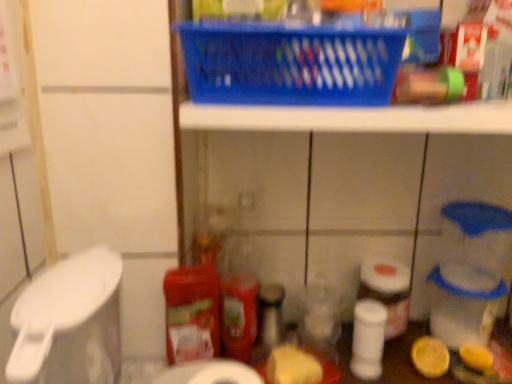
Where is `white matte toilet paper at lower right, which is the 3th toilet paper from left to right`? The image size is (512, 384). white matte toilet paper at lower right, which is the 3th toilet paper from left to right is located at coordinates (476, 356).

What is the approximate width of white matte toilet paper at lower center, arranged as the third toilet paper when viewed from the back?

white matte toilet paper at lower center, arranged as the third toilet paper when viewed from the back, is 4.71 inches wide.

This screenshot has height=384, width=512. What do you see at coordinates (368, 339) in the screenshot? I see `white matte toilet paper at center, acting as the second toilet paper starting from the right` at bounding box center [368, 339].

In order to face yellow matte lemon at lower right, should I rotate leftwards or rightwards?

Rotate right and turn 22.379 degrees.

What is the approximate width of matte red plastic bottle at center?

It is 1.43 inches.

Where is `white matte toilet paper at lower right, the third toilet paper viewed from the front`? This screenshot has height=384, width=512. white matte toilet paper at lower right, the third toilet paper viewed from the front is located at coordinates (476, 356).

Can you confirm if white matte toilet paper at lower right, the third toilet paper viewed from the front, is taller than yellow matte cheese at center?

Yes, white matte toilet paper at lower right, the third toilet paper viewed from the front, is taller than yellow matte cheese at center.

From a real-world perspective, is white matte toilet paper at lower right, the first toilet paper from the right, positioned under yellow matte cheese at center based on gravity?

Yes, from a real-world perspective, white matte toilet paper at lower right, the first toilet paper from the right, is beneath yellow matte cheese at center.

Considering the sizes of objects white matte toilet paper at lower right, the third toilet paper viewed from the front, and yellow matte cheese at center in the image provided, who is smaller, white matte toilet paper at lower right, the third toilet paper viewed from the front, or yellow matte cheese at center?

white matte toilet paper at lower right, the third toilet paper viewed from the front, is smaller.

Is point (472, 358) closer or farther from the camera than point (286, 362)?

Point (472, 358) is positioned farther from the camera compared to point (286, 362).

From a real-world perspective, does white matte toilet paper at center, positioned as the 2th toilet paper in left-to-right order, stand above matte red plastic bottle at center?

No, from a real-world perspective, white matte toilet paper at center, positioned as the 2th toilet paper in left-to-right order, is not on top of matte red plastic bottle at center.

Image resolution: width=512 pixels, height=384 pixels. In order to click on bottle that appears above the white matte toilet paper at center, the second toilet paper positioned from the front (from a real-world perspective) in this screenshot , I will do `click(239, 302)`.

Would you say white matte toilet paper at center, which is the 2th toilet paper from back to front, is to the left or to the right of matte red plastic bottle at center in the picture?

white matte toilet paper at center, which is the 2th toilet paper from back to front, is to the right of matte red plastic bottle at center.

Does white matte toilet paper at center, acting as the second toilet paper starting from the right, have a greater height compared to matte red plastic bottle at center?

No.

Is matte red plastic bottle at center further to the viewer compared to white matte toilet paper at center, which is the 2th toilet paper from back to front?

That is True.

Can we say matte red plastic bottle at center lies outside white matte toilet paper at center, positioned as the 2th toilet paper in left-to-right order?

That's correct, matte red plastic bottle at center is outside of white matte toilet paper at center, positioned as the 2th toilet paper in left-to-right order.

Considering the sizes of objects matte red plastic bottle at center and white matte toilet paper at center, which is the 2th toilet paper from back to front, in the image provided, who is thinner, matte red plastic bottle at center or white matte toilet paper at center, which is the 2th toilet paper from back to front,?

matte red plastic bottle at center is thinner.

Which of these two, matte red plastic bottle at center or white matte toilet paper at lower center, arranged as the third toilet paper when viewed from the back, is smaller?

Smaller between the two is matte red plastic bottle at center.

In the scene shown: Is matte red plastic bottle at center facing towards white matte toilet paper at lower center, arranged as the third toilet paper when viewed from the back?

Yes, matte red plastic bottle at center is aimed at white matte toilet paper at lower center, arranged as the third toilet paper when viewed from the back.

In order to click on bottle above the white matte toilet paper at lower center, arranged as the third toilet paper when viewed from the back (from the image's perspective) in this screenshot , I will do `click(239, 302)`.

Considering the positions of objects matte red plastic bottle at center and white matte toilet paper at lower center, arranged as the 1th toilet paper when viewed from the front, in the image provided, who is more to the right, matte red plastic bottle at center or white matte toilet paper at lower center, arranged as the 1th toilet paper when viewed from the front,?

matte red plastic bottle at center.

Between white matte toilet paper at lower center, positioned as the first toilet paper in left-to-right order, and matte red plastic bottle at center, which one has smaller width?

matte red plastic bottle at center.

Considering the relative positions of white matte toilet paper at lower center, placed as the 3th toilet paper when sorted from right to left, and matte red plastic bottle at center in the image provided, is white matte toilet paper at lower center, placed as the 3th toilet paper when sorted from right to left, to the right of matte red plastic bottle at center from the viewer's perspective?

No.

Are white matte toilet paper at lower center, arranged as the third toilet paper when viewed from the back, and matte red plastic bottle at center located far from each other?

They are positioned close to each other.

From a real-world perspective, between white matte toilet paper at lower center, arranged as the 1th toilet paper when viewed from the front, and matte red plastic bottle at center, who is vertically higher?

matte red plastic bottle at center is physically above.

Does blue plastic basket at upper center touch matte red plastic bottle at center?

No.

Could you tell me if blue plastic basket at upper center is facing matte red plastic bottle at center?

No, blue plastic basket at upper center does not turn towards matte red plastic bottle at center.

Can you confirm if blue plastic basket at upper center is thinner than matte red plastic bottle at center?

In fact, blue plastic basket at upper center might be wider than matte red plastic bottle at center.

Considering the relative sizes of blue plastic basket at upper center and matte red plastic bottle at center in the image provided, is blue plastic basket at upper center smaller than matte red plastic bottle at center?

No, blue plastic basket at upper center is not smaller than matte red plastic bottle at center.

Does yellow matte cheese at center have a greater height compared to blue plastic basket at upper center?

No, yellow matte cheese at center is not taller than blue plastic basket at upper center.

Which is less distant, (319, 372) or (226, 37)?

The point (226, 37) is closer to the camera.

Where is `food below the white matte toilet paper at lower right, the first toilet paper from the right (from the image's perspective)`? The width and height of the screenshot is (512, 384). food below the white matte toilet paper at lower right, the first toilet paper from the right (from the image's perspective) is located at coordinates (292, 366).

Image resolution: width=512 pixels, height=384 pixels. Identify the location of toilet paper that is the 1st one when counting forward from the matte red plastic bottle at center. [368, 339].

When comparing their distances from white matte toilet paper at center, which is the 2th toilet paper from back to front, does white matte toilet paper at lower center, placed as the 3th toilet paper when sorted from right to left, or yellow matte lemon at lower right seem further?

white matte toilet paper at lower center, placed as the 3th toilet paper when sorted from right to left, is positioned further to the anchor white matte toilet paper at center, which is the 2th toilet paper from back to front.

Based on their spatial positions, is yellow matte lemon at lower right or yellow matte cheese at center closer to matte red plastic bottle at center?

yellow matte cheese at center is closer to matte red plastic bottle at center.

Based on their spatial positions, is white matte toilet paper at center, positioned as the 2th toilet paper in left-to-right order, or yellow matte lemon at lower right further from yellow matte cheese at center?

yellow matte lemon at lower right is positioned further to the anchor yellow matte cheese at center.

From the picture: Which object lies nearer to the anchor point blue plastic basket at upper center, white matte toilet paper at center, which is the 2th toilet paper from back to front, or yellow matte lemon at lower right?

white matte toilet paper at center, which is the 2th toilet paper from back to front, is positioned closer to the anchor blue plastic basket at upper center.

When comparing their distances from white matte toilet paper at center, the second toilet paper positioned from the front, does yellow matte cheese at center or white matte toilet paper at lower right, the first toilet paper from the right, seem further?

white matte toilet paper at lower right, the first toilet paper from the right, is positioned further to the anchor white matte toilet paper at center, the second toilet paper positioned from the front.

Which object lies further to the anchor point white matte toilet paper at center, the second toilet paper positioned from the front, white matte toilet paper at lower right, placed as the first toilet paper when sorted from back to front, or matte red plastic bottle at center?

Based on the image, matte red plastic bottle at center appears to be further to white matte toilet paper at center, the second toilet paper positioned from the front.

From the picture: Which object lies further to the anchor point white matte toilet paper at center, which is the 2th toilet paper from back to front, yellow matte cheese at center or white matte toilet paper at lower center, positioned as the first toilet paper in left-to-right order?

white matte toilet paper at lower center, positioned as the first toilet paper in left-to-right order.

Which object lies further to the anchor point white matte toilet paper at lower center, arranged as the 1th toilet paper when viewed from the front, matte red plastic bottle at center or yellow matte cheese at center?

The object further to white matte toilet paper at lower center, arranged as the 1th toilet paper when viewed from the front, is matte red plastic bottle at center.

The width and height of the screenshot is (512, 384). I want to click on food between matte red plastic bottle at center and yellow matte lemon at lower right in the horizontal direction, so click(292, 366).

Locate an element on the screen. This screenshot has height=384, width=512. toilet paper located between white matte toilet paper at lower center, arranged as the 1th toilet paper when viewed from the front, and white matte toilet paper at lower right, the first toilet paper from the right, in the left-right direction is located at coordinates (368, 339).

At what (x,y) coordinates should I click in order to perform the action: click on bottle that lies between blue plastic basket at upper center and white matte toilet paper at center, which is the 2th toilet paper from back to front, from top to bottom. Please return your answer as a coordinate pair (x, y). The width and height of the screenshot is (512, 384). Looking at the image, I should click on (239, 302).

Locate an element on the screen. The height and width of the screenshot is (384, 512). food between matte red plastic bottle at center and white matte toilet paper at center, the second toilet paper positioned from the front, in the horizontal direction is located at coordinates (292, 366).